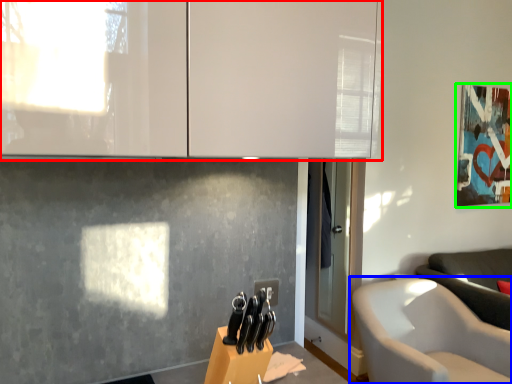
Question: Considering the real-world distances, which object is farthest from cabinetry (highlighted by a red box)? chair (highlighted by a blue box) or picture frame (highlighted by a green box)?

Choices:
 (A) chair
 (B) picture frame

Answer: (B)